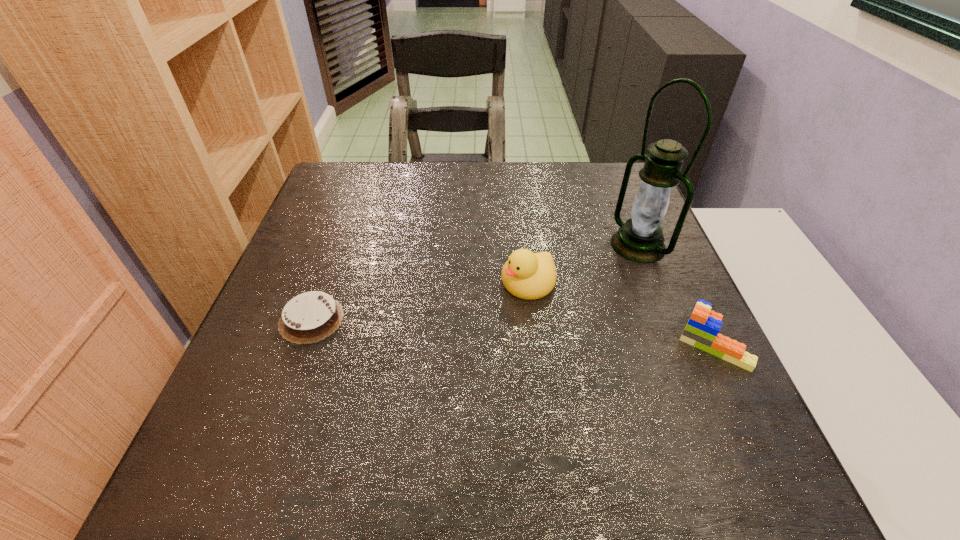
Where is `free space on the desktop that is between the chocolate cake and the third tallest object and is positioned on the side where the tallest object emits light`? free space on the desktop that is between the chocolate cake and the third tallest object and is positioned on the side where the tallest object emits light is located at coordinates (483, 329).

I want to click on vacant space on the desktop that is between the shortest object and the Lego and is positioned on the face of the third object from right to left, so pos(456,327).